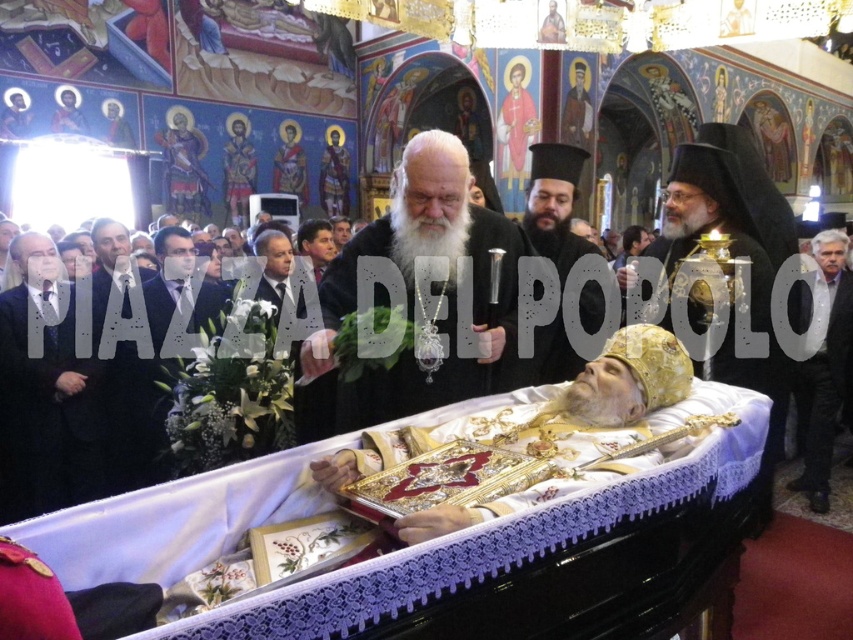
You are a photographer standing in the middle of the church. You want to take a photo of the black suit at left and the casket with the person in golden vestments. Can you fit both in your camera frame if your camera has a 10 meter maximum width?

The black suit at left and the casket with the person in golden vestments are 16.55 meters apart, which exceeds the camera frame width of 10 meters. Therefore, both cannot be captured in a single photo.

You are a photographer standing at the entrance of the church. You need to capture a photo that includes both the black suit at left and the gray wool suit at right. Given that your camera has a maximum focal length of 50 feet, can you position yourself in a way to include both subjects in the frame without moving them?

The black suit at left is 58.94 feet from the gray wool suit at right, which exceeds the camera lens focal length of 50 feet. Therefore, it would not be possible to capture both subjects in the same frame without moving them.